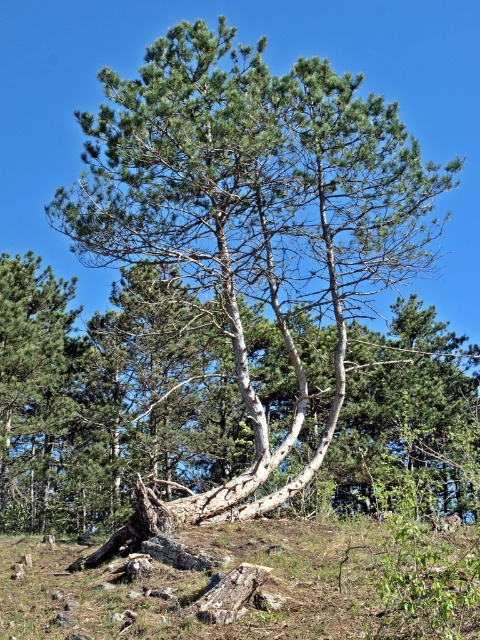
Is smooth white bark tree at center above smooth white tree trunk at center?

Actually, smooth white bark tree at center is below smooth white tree trunk at center.

Is smooth white bark tree at center closer to camera compared to smooth white tree trunk at center?

No.

You are a GUI agent. You are given a task and a screenshot of the screen. Output one action in this format:
    pyautogui.click(x=<x>, y=<y>)
    Task: Click on the smooth white bark tree at center
    
    Given the screenshot: What is the action you would take?
    pyautogui.click(x=252, y=225)

In the scene shown: Is smooth white tree trunk at center below brown rough tree stump at center?

No.

Is point (288, 410) farther from viewer compared to point (216, 573)?

Yes, point (288, 410) is farther from viewer.

Describe the element at coordinates (108, 397) in the screenshot. The image size is (480, 640). I see `smooth white tree trunk at center` at that location.

Identify the location of smooth white tree trunk at center. (108, 397).

Is point (170, 35) farther from camera compared to point (167, 604)?

Yes, it is.

Which is behind, point (156, 120) or point (337, 522)?

Positioned behind is point (337, 522).

The image size is (480, 640). Identify the location of smooth white bark tree at center. (252, 225).